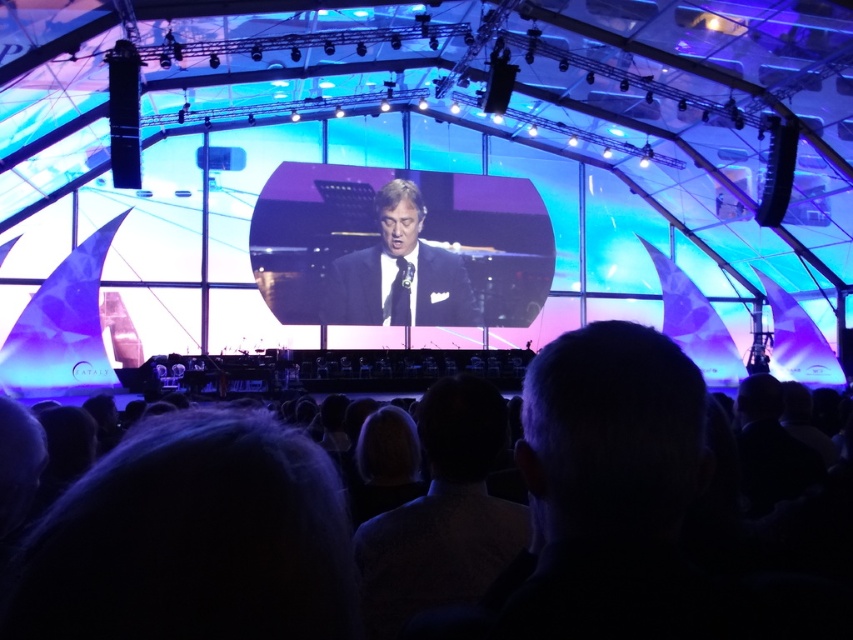
Question: Is dark hair at lower center positioned in front of matte black suit at center?

Choices:
 (A) yes
 (B) no

Answer: (A)

Question: Does dark hair at lower center have a smaller size compared to black silk suit at center?

Choices:
 (A) no
 (B) yes

Answer: (B)

Question: Which object is farther from the camera taking this photo?

Choices:
 (A) dark hair at lower center
 (B) black silk suit at center

Answer: (B)

Question: Which of the following is the farthest from the observer?

Choices:
 (A) (363, 244)
 (B) (339, 532)

Answer: (A)

Question: Estimate the real-world distances between objects in this image. Which object is farther from the black silk suit at center?

Choices:
 (A) dark hair at lower center
 (B) matte black suit at center

Answer: (A)

Question: Can you confirm if black silk suit at center is bigger than matte black suit at center?

Choices:
 (A) yes
 (B) no

Answer: (A)